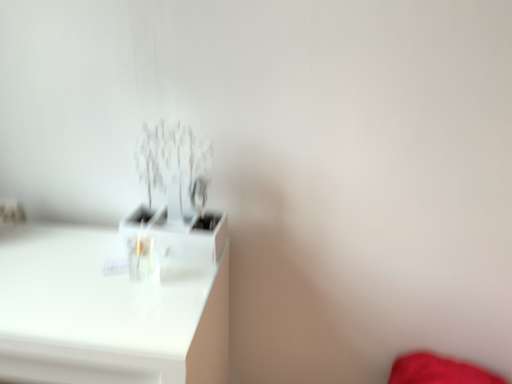
This screenshot has height=384, width=512. Find the location of `white glossy desk at left`. white glossy desk at left is located at coordinates (106, 313).

Describe the element at coordinates (106, 313) in the screenshot. This screenshot has height=384, width=512. I see `white glossy desk at left` at that location.

Identify the location of white glossy desk at left. (106, 313).